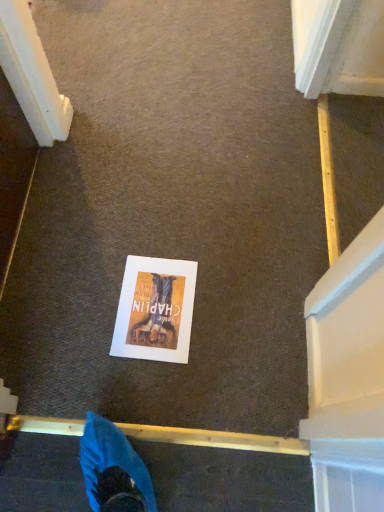
Identify the location of vacant location behind white paper at center. The height and width of the screenshot is (512, 384). (162, 234).